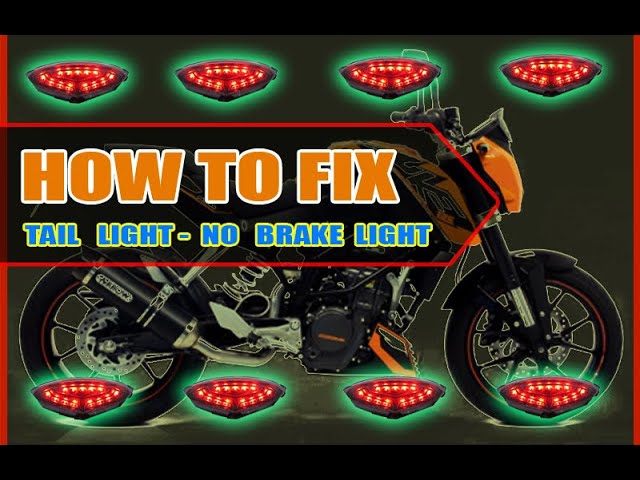
Where is `red lights`? red lights is located at coordinates (92, 93), (200, 78), (349, 78), (534, 73), (539, 399), (390, 402), (249, 396), (96, 391).